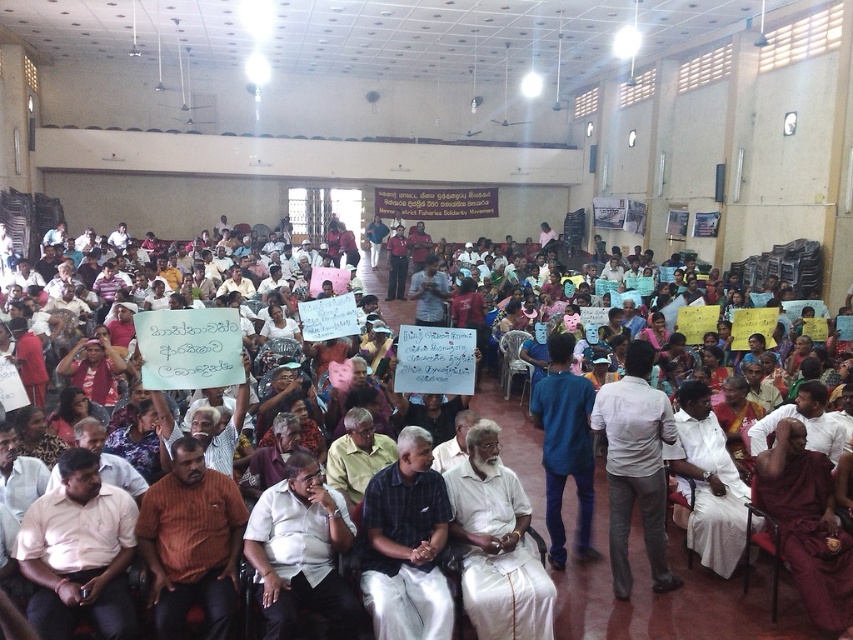
Question: Which point is closer to the camera taking this photo?

Choices:
 (A) (165, 483)
 (B) (577, 628)
 (C) (416, 481)

Answer: (A)

Question: Among these points, which one is farthest from the camera?

Choices:
 (A) (193, 588)
 (B) (691, 572)

Answer: (B)

Question: Does pink shirt at lower left appear on the left side of brown striped shirt at lower left?

Choices:
 (A) no
 (B) yes

Answer: (B)

Question: Is dark blue shirt at center positioned before white cotton shirt at center?

Choices:
 (A) no
 (B) yes

Answer: (B)

Question: Which point is farther to the camera?

Choices:
 (A) dark blue shirt at center
 (B) white cotton shirt at center
 (C) brown striped shirt at lower left
 (D) white shirt at center

Answer: (B)

Question: Is the position of dark blue shirt at center less distant than that of white cotton shirt at center?

Choices:
 (A) yes
 (B) no

Answer: (A)